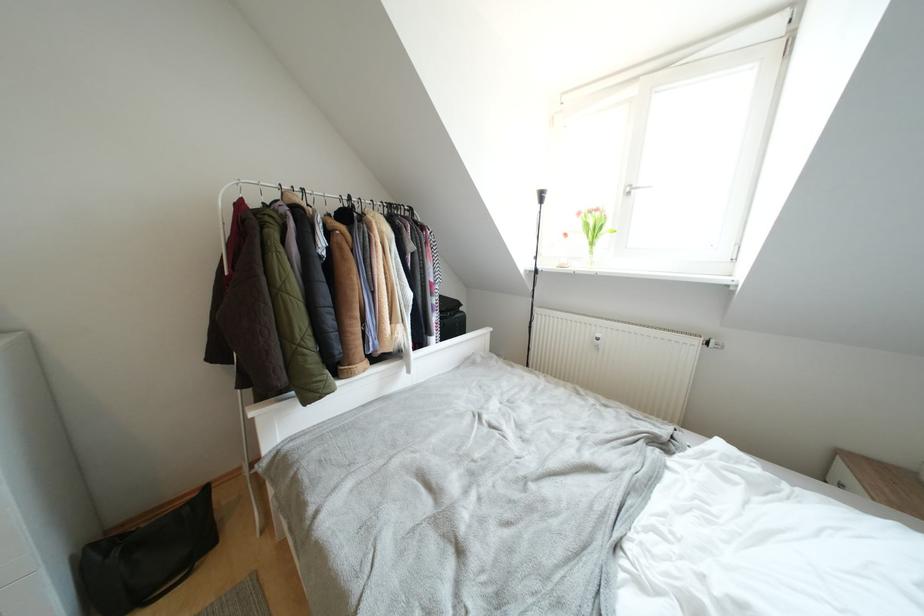
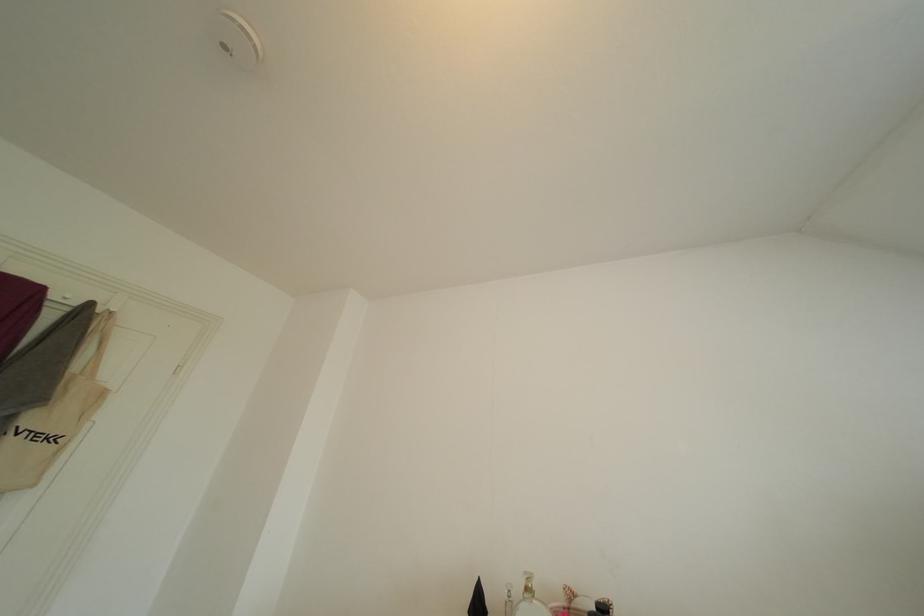
The images are taken continuously from a first-person perspective. In which direction is your viewpoint rotating?

The camera's rotation is toward left-up.